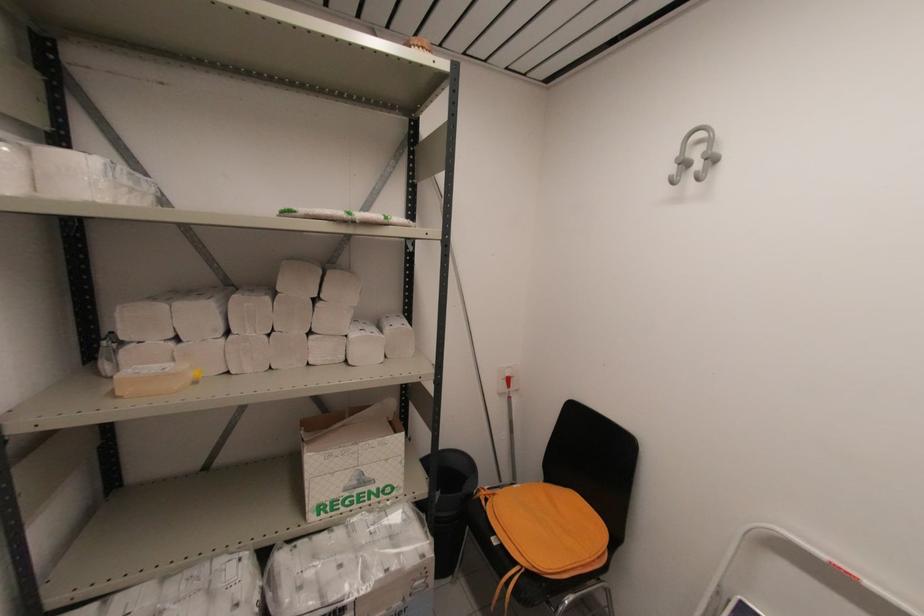
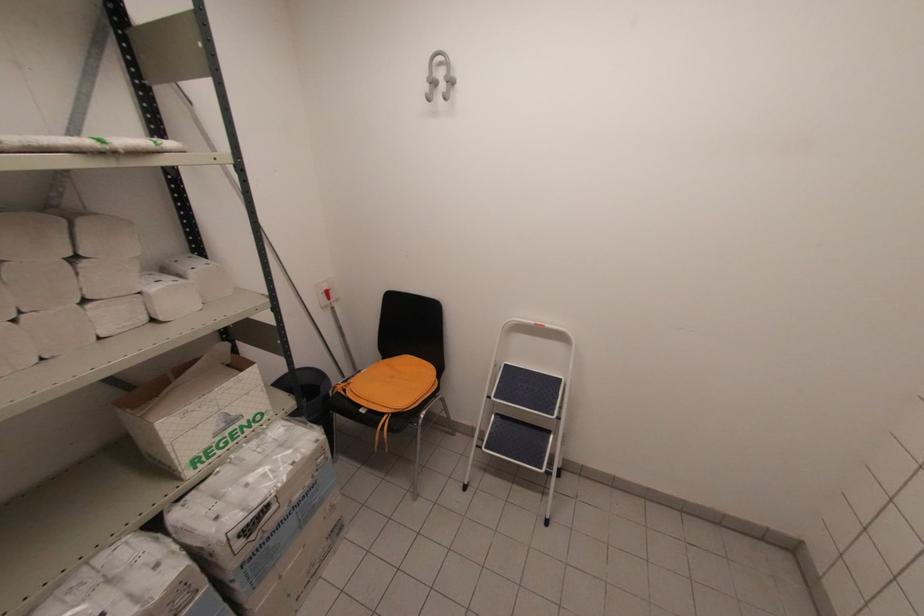
The point at (317, 296) is marked in the first image. Where is the corresponding point in the second image?

(71, 254)